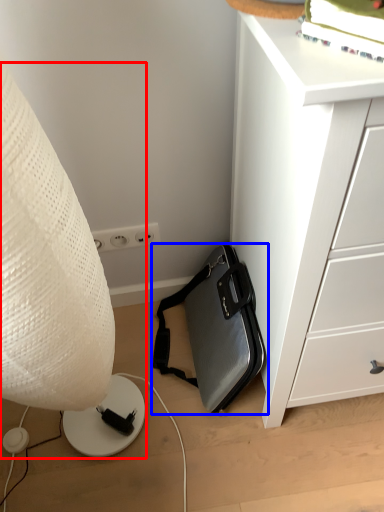
Question: Which object is further to the camera taking this photo, lamp (highlighted by a red box) or luggage and bags (highlighted by a blue box)?

Choices:
 (A) lamp
 (B) luggage and bags

Answer: (B)